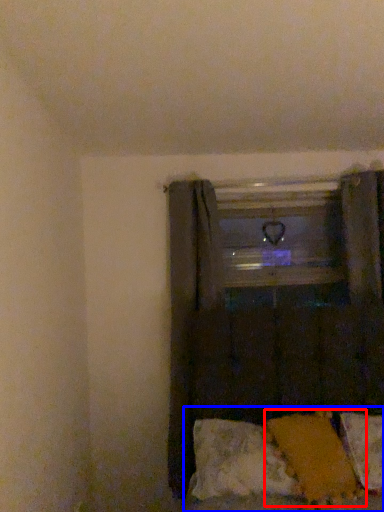
Question: Which point is further to the camera, pillow (highlighted by a red box) or bed (highlighted by a blue box)?

Choices:
 (A) pillow
 (B) bed

Answer: (B)